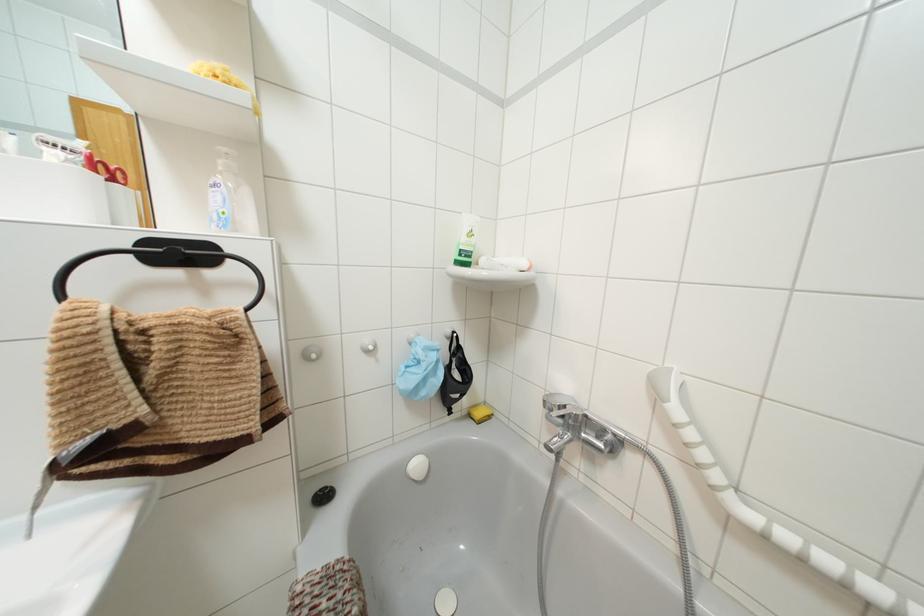
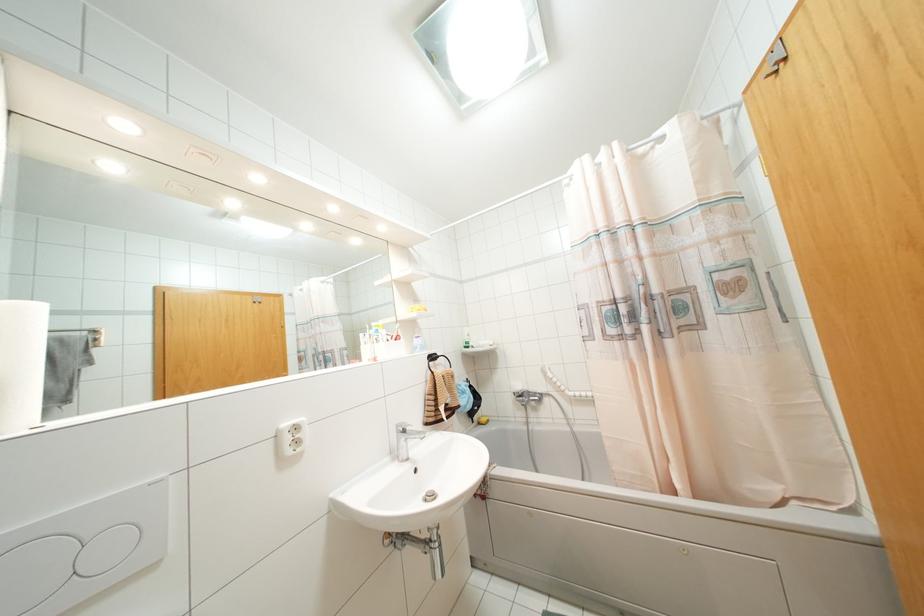
In the second image, find the point that corresponds to (468,416) in the first image.

(479, 423)